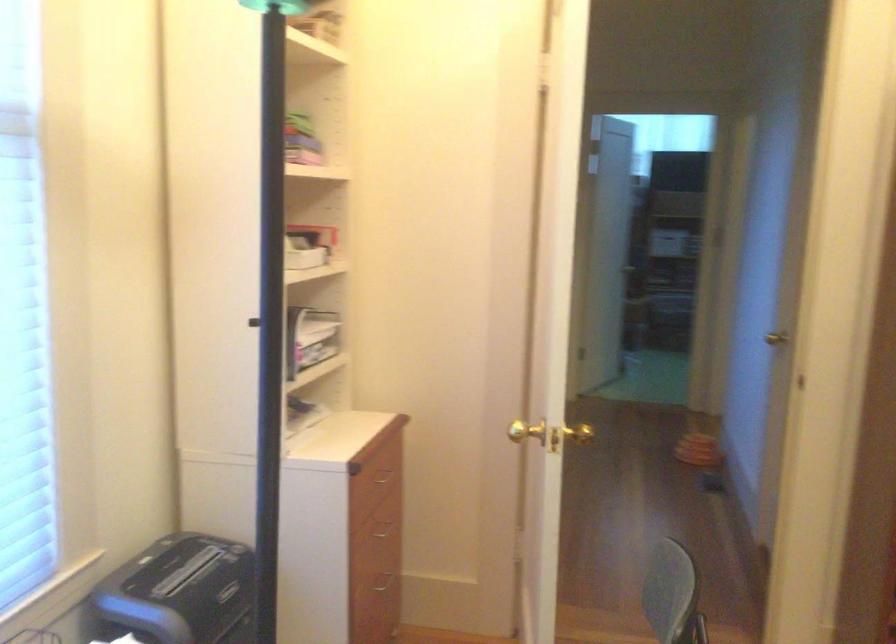
Where is `black lamp handle`? The height and width of the screenshot is (644, 896). black lamp handle is located at coordinates (282, 6).